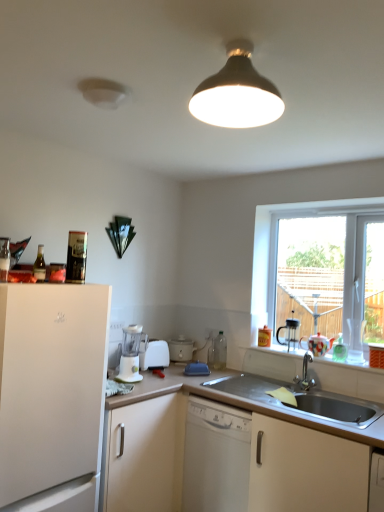
Find the location of a particular element. The image size is (384, 512). free location to the right of white plastic coffee machine at lower center, the first coffee machine viewed from the left is located at coordinates (158, 380).